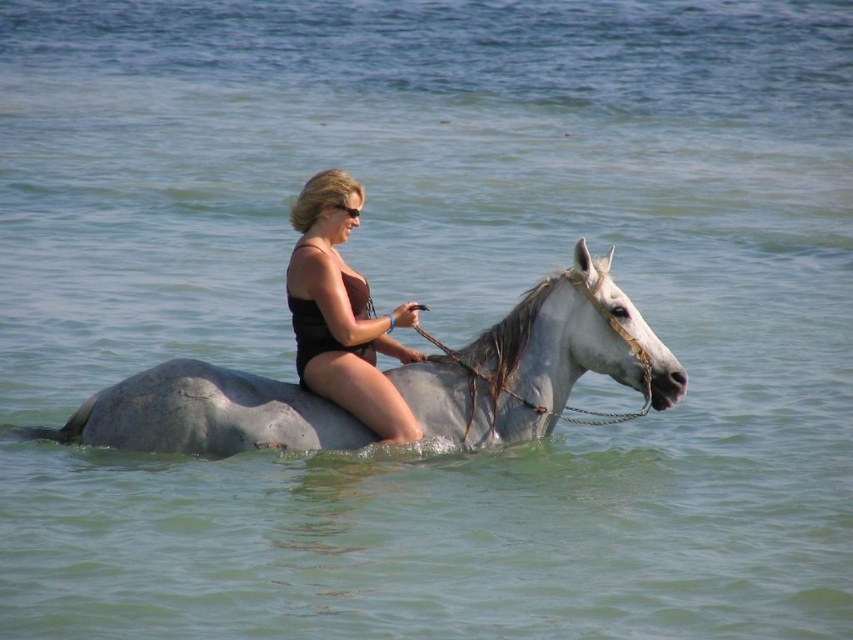
Question: Which point is farther from the camera taking this photo?

Choices:
 (A) (459, 420)
 (B) (332, 307)

Answer: (A)

Question: Is white glossy horse at center bigger than black matte swimsuit at center?

Choices:
 (A) no
 (B) yes

Answer: (B)

Question: Is white glossy horse at center to the right of black matte swimsuit at center from the viewer's perspective?

Choices:
 (A) yes
 (B) no

Answer: (A)

Question: Does white glossy horse at center appear under black matte swimsuit at center?

Choices:
 (A) no
 (B) yes

Answer: (B)